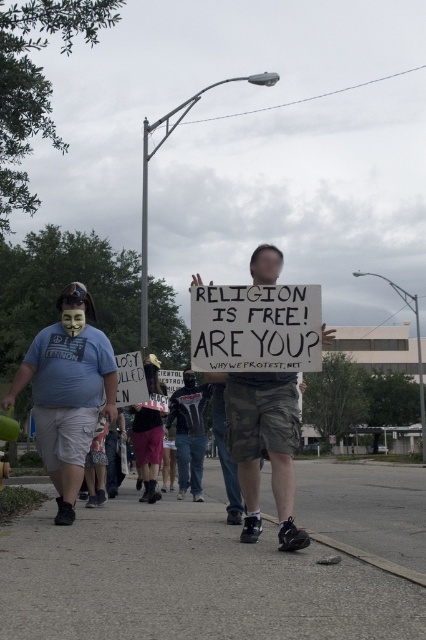
Question: Considering the real-world distances, which object is farthest from the white paper sign at center?

Choices:
 (A) matte cardboard sign at center
 (B) matte blue t-shirt at left

Answer: (B)

Question: Which is farther from the gray asphalt pavement at lower center?

Choices:
 (A) black leather jacket at center
 (B) matte cardboard sign at center
 (C) white paper sign at center
 (D) matte blue t-shirt at left

Answer: (D)

Question: Does gray asphalt pavement at lower center lie behind black leather jacket at center?

Choices:
 (A) yes
 (B) no

Answer: (B)

Question: Does gray asphalt pavement at lower center have a larger size compared to white paper sign at center?

Choices:
 (A) yes
 (B) no

Answer: (A)

Question: Among these objects, which one is nearest to the camera?

Choices:
 (A) white paper sign at center
 (B) matte blue t-shirt at left
 (C) black leather jacket at center
 (D) matte cardboard sign at center

Answer: (D)

Question: Does gray asphalt pavement at lower center appear on the right side of matte cardboard sign at center?

Choices:
 (A) yes
 (B) no

Answer: (B)